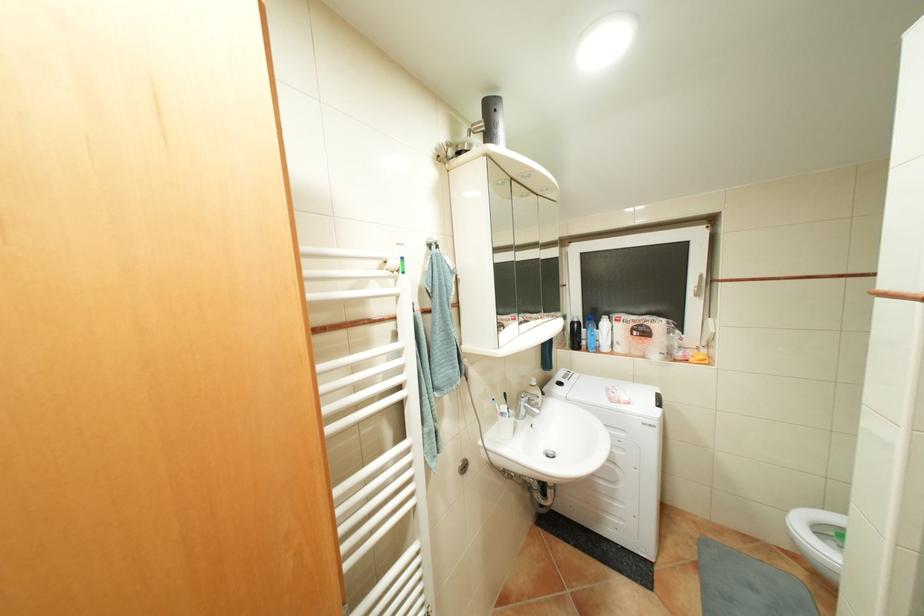
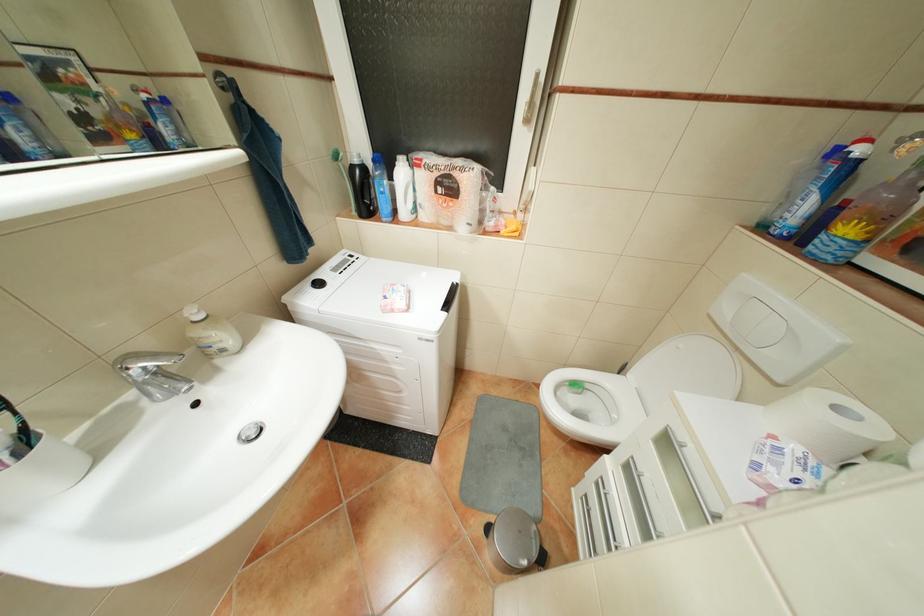
Find the pixel in the second image that matches [546,403] in the first image.

(233, 350)